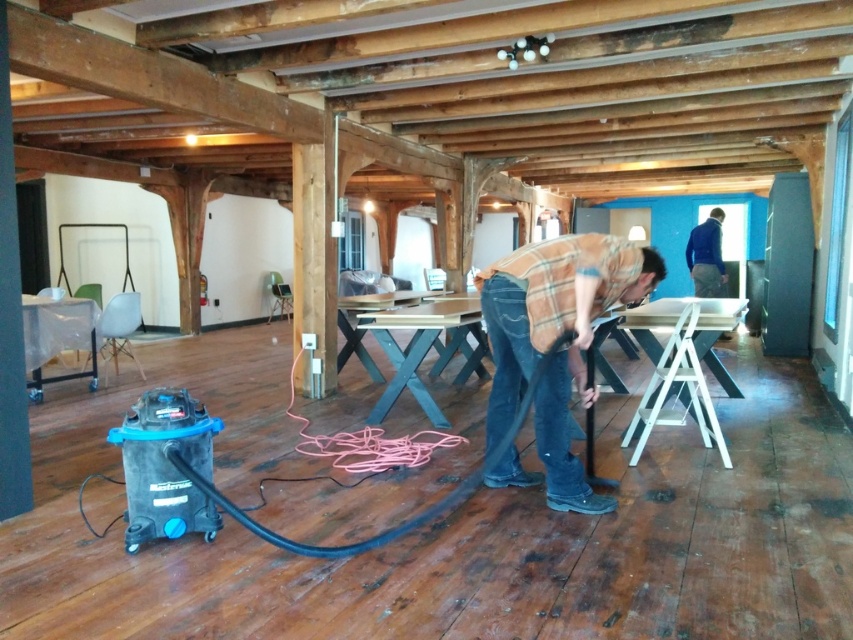
Question: Where is brown plaid shirt at center located in relation to dark blue sweater at upper right in the image?

Choices:
 (A) right
 (B) left

Answer: (B)

Question: Which point is farther to the camera?

Choices:
 (A) brown plaid shirt at center
 (B) dark blue sweater at upper right

Answer: (B)

Question: Which point is closer to the camera taking this photo?

Choices:
 (A) (714, 252)
 (B) (521, 269)

Answer: (B)

Question: Which point appears closest to the camera in this image?

Choices:
 (A) (709, 230)
 (B) (486, 280)

Answer: (B)

Question: Does brown plaid shirt at center have a larger size compared to dark blue sweater at upper right?

Choices:
 (A) no
 (B) yes

Answer: (B)

Question: Is the position of brown plaid shirt at center less distant than that of dark blue sweater at upper right?

Choices:
 (A) yes
 (B) no

Answer: (A)